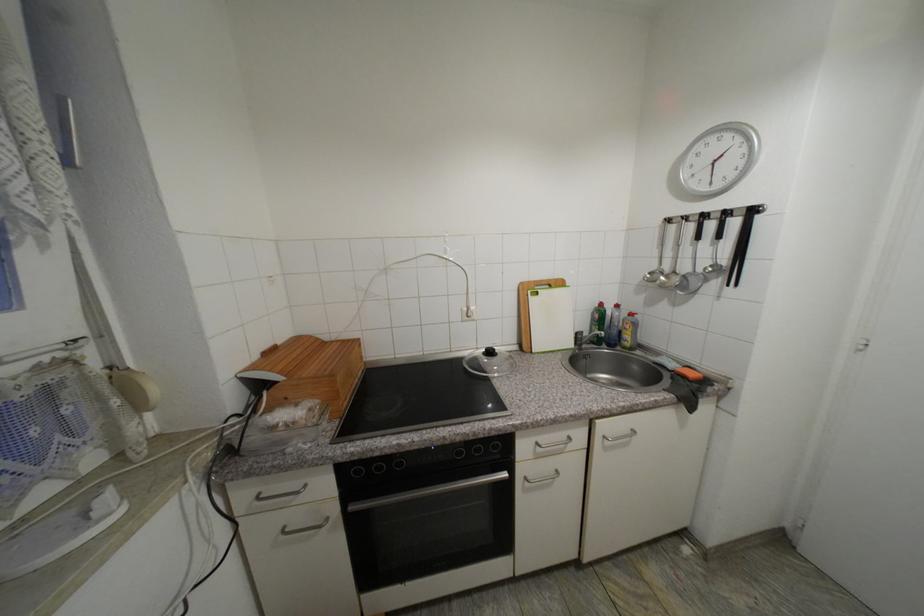
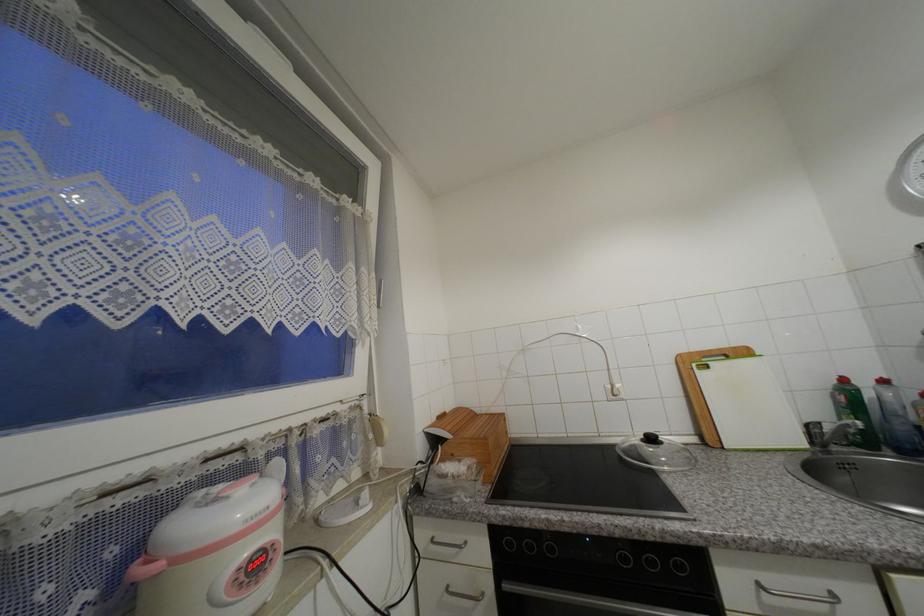
In the second image, find the point that corresponds to point 358,509 in the first image.

(512, 588)